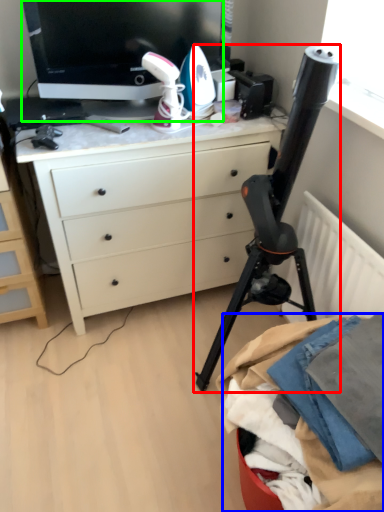
Question: Which object is the closest to the tripod (highlighted by a red box)? Choose among these: clothing (highlighted by a blue box) or television (highlighted by a green box).

Choices:
 (A) clothing
 (B) television

Answer: (A)